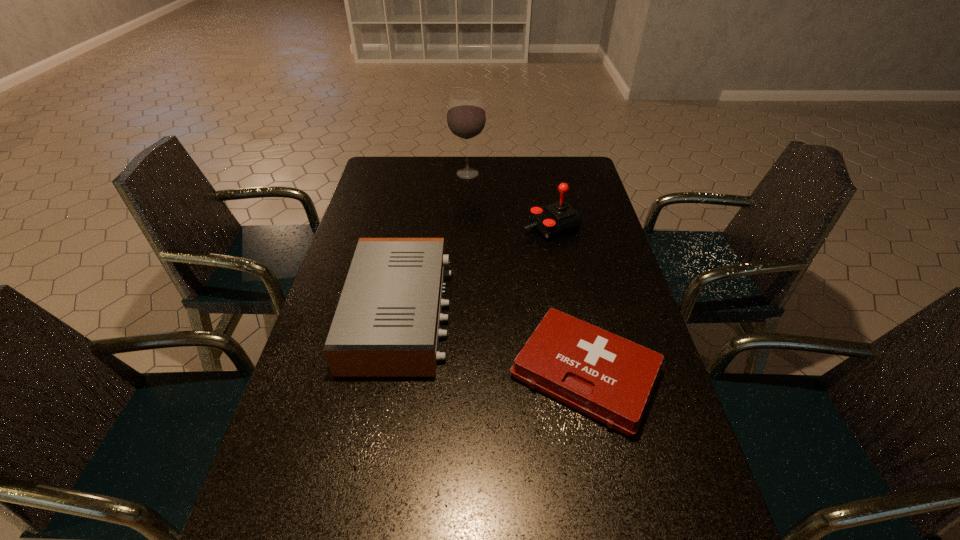
At what (x,y) coordinates should I click in order to perform the action: click on free space between the shortest object and the alcohol. Please return your answer as a coordinate pair (x, y). Looking at the image, I should click on (526, 273).

The width and height of the screenshot is (960, 540). Find the location of `free space between the third tallest object and the third shortest object`. free space between the third tallest object and the third shortest object is located at coordinates (476, 270).

Find the location of a particular element. The width and height of the screenshot is (960, 540). object that is the third closest to the tallest object is located at coordinates (609, 378).

Locate an element on the screen. The image size is (960, 540). the closest object to the tallest object is located at coordinates (555, 219).

You are a GUI agent. You are given a task and a screenshot of the screen. Output one action in this format:
    pyautogui.click(x=<x>, y=<y>)
    Task: Click on the free space that satisfies the following two spatial constraints: 1. on the control panel of the first-aid kit; 2. on the right side of the radio receiver
    The height and width of the screenshot is (540, 960).
    Given the screenshot: What is the action you would take?
    pyautogui.click(x=390, y=373)

This screenshot has height=540, width=960. What are the coordinates of `vacant space that satisfies the following two spatial constraints: 1. on the front side of the tallest object; 2. on the control panel of the radio receiver` in the screenshot? It's located at (462, 313).

You are a GUI agent. You are given a task and a screenshot of the screen. Output one action in this format:
    pyautogui.click(x=<x>, y=<y>)
    Task: Click on the free location that satisfies the following two spatial constraints: 1. on the front side of the tallest object; 2. on the right side of the third nearest object
    The image size is (960, 540).
    Given the screenshot: What is the action you would take?
    pyautogui.click(x=466, y=227)

Find the location of a particular element. This screenshot has height=540, width=960. vacant point that satisfies the following two spatial constraints: 1. on the control panel of the first-aid kit; 2. on the left side of the radio receiver is located at coordinates (390, 373).